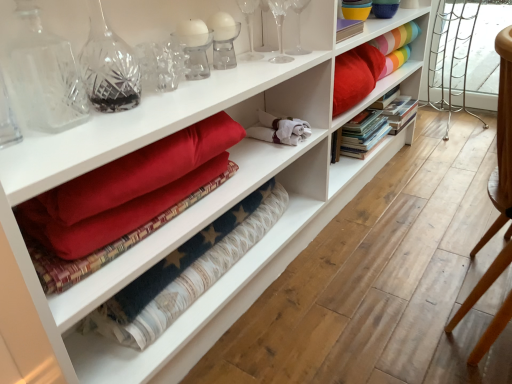
Question: Can you confirm if white cotton towels at center is bigger than rainbow striped fabric at upper right?

Choices:
 (A) no
 (B) yes

Answer: (A)

Question: Is white cotton towels at center further to camera compared to rainbow striped fabric at upper right?

Choices:
 (A) yes
 (B) no

Answer: (B)

Question: Does white cotton towels at center have a greater height compared to rainbow striped fabric at upper right?

Choices:
 (A) yes
 (B) no

Answer: (B)

Question: From the image's perspective, is white cotton towels at center on top of rainbow striped fabric at upper right?

Choices:
 (A) yes
 (B) no

Answer: (B)

Question: From a real-world perspective, is white cotton towels at center located higher than rainbow striped fabric at upper right?

Choices:
 (A) yes
 (B) no

Answer: (B)

Question: Does white cotton towels at center come in front of rainbow striped fabric at upper right?

Choices:
 (A) yes
 (B) no

Answer: (A)

Question: Is white cotton towels at center further to the viewer compared to clear crystal glass at upper center, which appears as the second glass vase when viewed from the left?

Choices:
 (A) no
 (B) yes

Answer: (B)

Question: Is white cotton towels at center located outside clear crystal glass at upper center, marked as the 2th glass vase in a front-to-back arrangement?

Choices:
 (A) no
 (B) yes

Answer: (B)

Question: From a real-world perspective, is white cotton towels at center beneath clear crystal glass at upper center, which is the second glass vase in back-to-front order?

Choices:
 (A) yes
 (B) no

Answer: (A)

Question: Is clear crystal glass at upper center, acting as the 2th glass vase starting from the right, a part of white cotton towels at center?

Choices:
 (A) yes
 (B) no

Answer: (B)

Question: Is the surface of white cotton towels at center in direct contact with clear crystal glass at upper center, which is the second glass vase in back-to-front order?

Choices:
 (A) no
 (B) yes

Answer: (A)

Question: Is white cotton towels at center shorter than clear crystal glass at upper center, marked as the 2th glass vase in a front-to-back arrangement?

Choices:
 (A) yes
 (B) no

Answer: (A)

Question: Considering the relative positions of clear crystal glass at upper center, which appears as the second glass vase when viewed from the left, and white cotton towels at center in the image provided, is clear crystal glass at upper center, which appears as the second glass vase when viewed from the left, to the left of white cotton towels at center from the viewer's perspective?

Choices:
 (A) yes
 (B) no

Answer: (B)